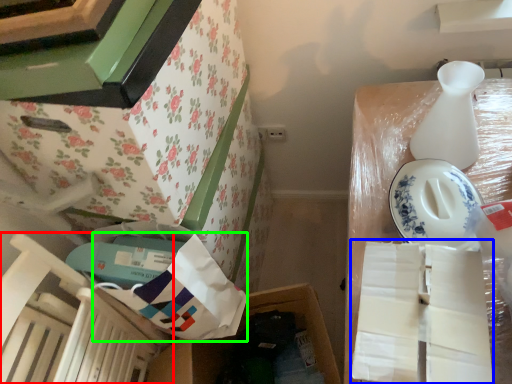
Question: Which object is positioned farthest from chair (highlighted by a red box)? Select from wrapping paper (highlighted by a blue box) and wrapping paper (highlighted by a green box).

Choices:
 (A) wrapping paper
 (B) wrapping paper

Answer: (A)